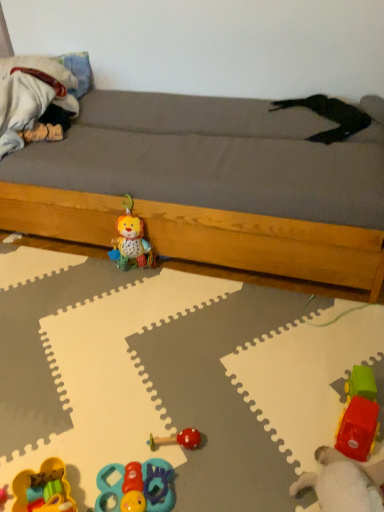
This screenshot has width=384, height=512. Find the location of `free space to the back side of rubberized blue and red toy at lower center, which appears as the third toy when viewed from the left`. free space to the back side of rubberized blue and red toy at lower center, which appears as the third toy when viewed from the left is located at coordinates (137, 426).